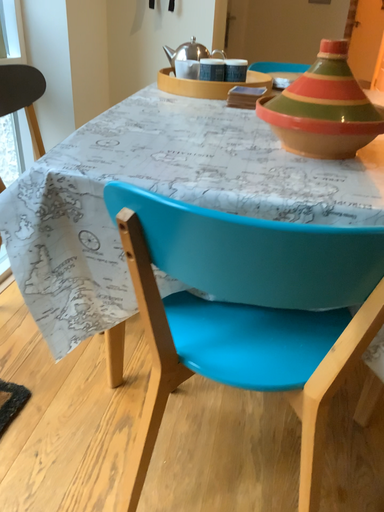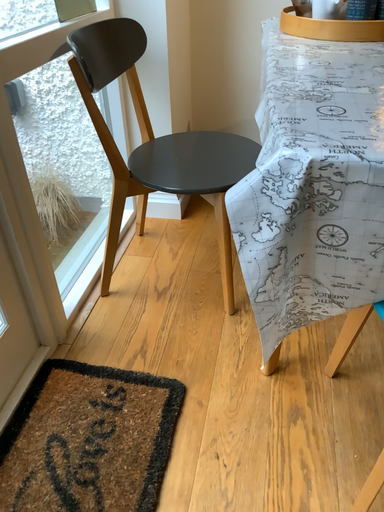
Question: How did the camera likely rotate when shooting the video?

Choices:
 (A) rotated downward
 (B) rotated upward

Answer: (A)